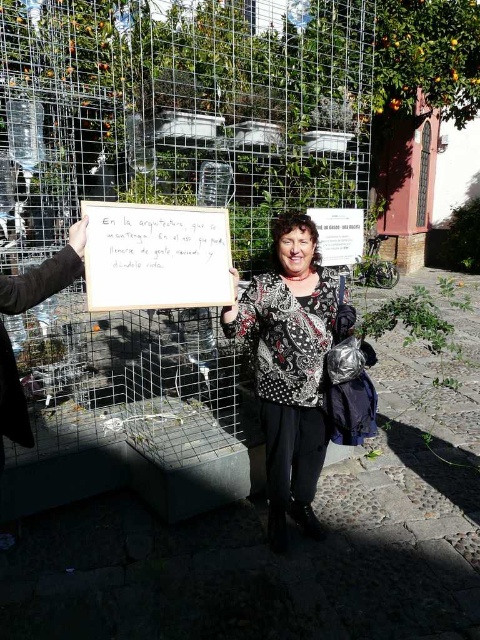
You are an artist planning to paint a mural on the wire mesh fence at center and the patterned fabric jacket at center. Which object requires a larger canvas to cover its entire width?

The wire mesh fence at center requires a larger canvas because its width surpasses that of the patterned fabric jacket at center.

You are a photographer trying to capture the wire mesh fence at center and the orange matte at upper right in the same frame. Based on their positions, which object should you adjust your camera to focus on first to ensure both are in the shot?

The wire mesh fence at center is positioned on the left side of orange matte at upper right, so you should focus on the orange matte at upper right first to ensure both are included in the frame.

Based on the scene description, where is the wire mesh fence at center located in the image?

The wire mesh fence at center is located at point (179, 115).